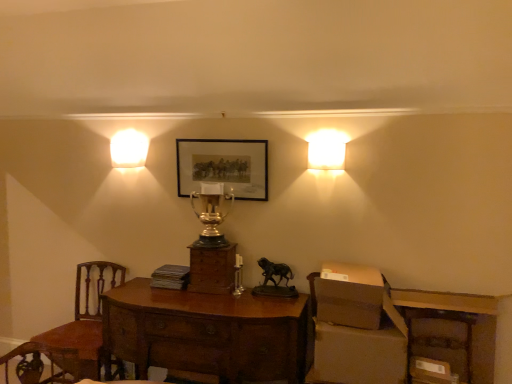
Locate an element on the screen. This screenshot has width=512, height=384. free spot above mahogany wood desk at center (from a real-world perspective) is located at coordinates (230, 303).